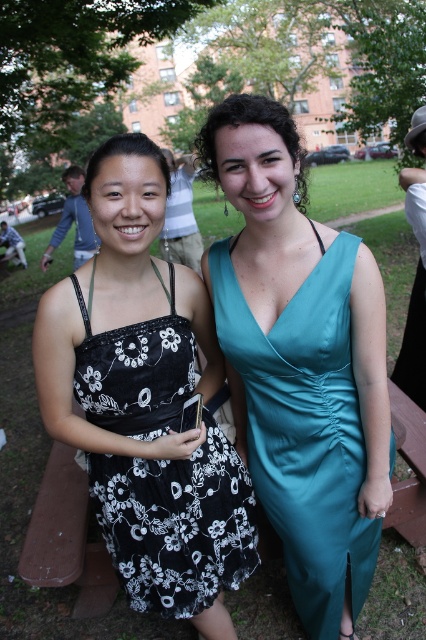
Question: Does teal satin dress at center lie behind black floral dress at center?

Choices:
 (A) yes
 (B) no

Answer: (B)

Question: Can you confirm if teal satin dress at center is positioned to the right of black floral dress at center?

Choices:
 (A) no
 (B) yes

Answer: (B)

Question: Does teal satin dress at center lie in front of black floral dress at center?

Choices:
 (A) yes
 (B) no

Answer: (A)

Question: Among these objects, which one is nearest to the camera?

Choices:
 (A) black floral dress at center
 (B) teal satin dress at center

Answer: (B)

Question: Which of the following is the farthest from the observer?

Choices:
 (A) teal satin dress at center
 (B) black floral dress at center

Answer: (B)